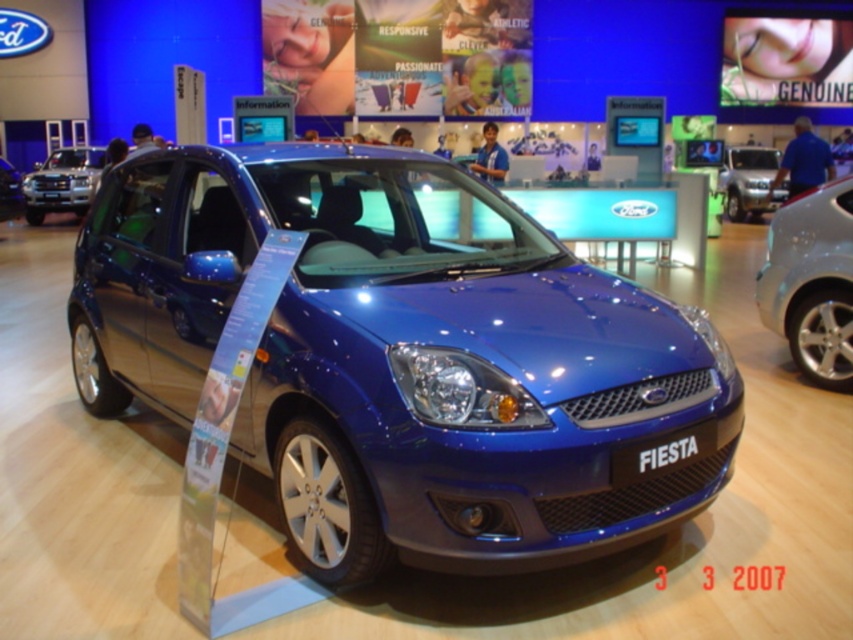
You are a parking attendant who needs to move the satin silver car at right and the silver metallic minivan at upper right to another lot. The path to the exit is narrow, only allowing vehicles to pass one at a time. Based on the distance between them, can both vehicles be moved out without needing to adjust their positions first?

The distance between the satin silver car at right and the silver metallic minivan at upper right is 40.69 feet. Since the path only allows one vehicle at a time, the two vehicles are already spaced apart sufficiently to move them individually through the exit without needing to adjust their positions first.

You are standing at the silver metallic suv at left and want to take a photo of the car in front of you using a camera. The camera is 17.15 meters away from the suv. Is the camera within the recommended 15 meter range for optimal photo quality?

The camera is 17.15 meters away from the silver metallic suv at left, which exceeds the recommended 15 meter range for optimal photo quality. Therefore, the camera is not within the optimal range.

You are at an auto show and want to find the silver metallic suv at left and the silver metallic minivan at upper right. Based on the scene description, which direction should you look first to see both vehicles in your line of sight?

You should look towards the left first to see the silver metallic suv at left, then shift your gaze towards the upper right to also see the silver metallic minivan at upper right since the silver metallic suv at left is positioned to the left of the silver metallic minivan at upper right.